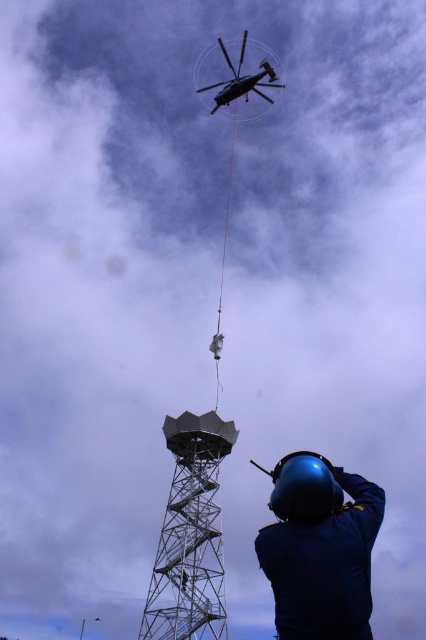
Does blue hard hat at lower right appear under metallic gray tower at center?

Incorrect, blue hard hat at lower right is not positioned below metallic gray tower at center.

Who is more distant from viewer, (336, 577) or (196, 484)?

The point (196, 484) is more distant.

Which is behind, point (310, 637) or point (212, 474)?

The point (212, 474) is more distant.

Where is `blue hard hat at lower right`? This screenshot has height=640, width=426. blue hard hat at lower right is located at coordinates (319, 548).

Is blue hard hat at lower right taller than metallic gray helicopter at upper center?

Correct, blue hard hat at lower right is much taller as metallic gray helicopter at upper center.

Who is more distant from viewer, (345, 604) or (261, 54)?

The point (261, 54) is more distant.

You are a GUI agent. You are given a task and a screenshot of the screen. Output one action in this format:
    pyautogui.click(x=<x>, y=<y>)
    Task: Click on the blue hard hat at lower right
    The width and height of the screenshot is (426, 640).
    Given the screenshot: What is the action you would take?
    pyautogui.click(x=319, y=548)

Does metallic gray tower at center lie in front of metallic gray helicopter at upper center?

Yes, metallic gray tower at center is in front of metallic gray helicopter at upper center.

Who is positioned more to the left, metallic gray tower at center or metallic gray helicopter at upper center?

From the viewer's perspective, metallic gray tower at center appears more on the left side.

Identify the location of metallic gray tower at center. (190, 534).